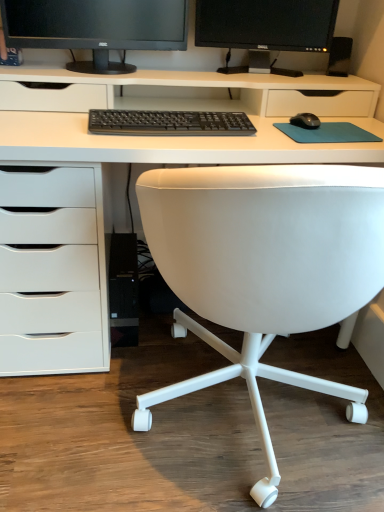
You are a GUI agent. You are given a task and a screenshot of the screen. Output one action in this format:
    pyautogui.click(x=<x>, y=<y>)
    Task: Click on the space that is in front of black matte mouse at right
    The image size is (384, 512).
    Given the screenshot: What is the action you would take?
    pyautogui.click(x=315, y=134)